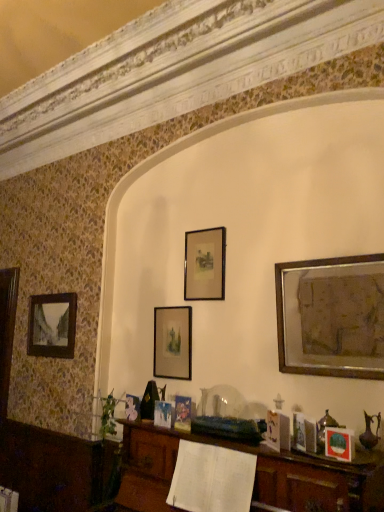
Describe the element at coordinates (339, 444) in the screenshot. This screenshot has height=512, width=384. I see `matte black picture frame at lower right, the second picture frame in the right-to-left sequence` at that location.

This screenshot has height=512, width=384. Find the location of `matte black picture frame at center, marked as the 4th picture frame in a right-to-left arrangement`. matte black picture frame at center, marked as the 4th picture frame in a right-to-left arrangement is located at coordinates (173, 342).

Measure the distance between matte black picture frame at left, arranged as the 5th picture frame when viewed from the right, and camera.

3.34 meters.

The height and width of the screenshot is (512, 384). Find the location of `matte black picture frame at lower right, the fourth picture frame in the left-to-right sequence`. matte black picture frame at lower right, the fourth picture frame in the left-to-right sequence is located at coordinates (339, 444).

The height and width of the screenshot is (512, 384). I want to click on the 2nd picture frame to the right of the matte black picture frame at left, acting as the 1th picture frame starting from the left, starting your count from the anchor, so click(x=205, y=264).

From a real-world perspective, is matte black picture frame at left, arranged as the 5th picture frame when viewed from the right, positioned above or below matte black picture frame at center, which ranks as the third picture frame in left-to-right order?

matte black picture frame at left, arranged as the 5th picture frame when viewed from the right, is situated lower than matte black picture frame at center, which ranks as the third picture frame in left-to-right order, in the real world.

Is matte black picture frame at left, acting as the first picture frame starting from the back, wider or thinner than matte black picture frame at center, which ranks as the third picture frame in left-to-right order?

Clearly, matte black picture frame at left, acting as the first picture frame starting from the back, has more width compared to matte black picture frame at center, which ranks as the third picture frame in left-to-right order.

Is matte black picture frame at left, arranged as the 5th picture frame when viewed from the right, shorter than matte black picture frame at center, which ranks as the third picture frame in front-to-back order?

No.

Can matte black picture frame at left, arranged as the 5th picture frame when viewed from the right, be found inside matte black picture frame at lower right, marked as the fifth picture frame in a back-to-front arrangement?

No, matte black picture frame at left, arranged as the 5th picture frame when viewed from the right, is not surrounded by matte black picture frame at lower right, marked as the fifth picture frame in a back-to-front arrangement.

Is matte black picture frame at lower right, which appears as the first picture frame when viewed from the front, closer to camera compared to matte black picture frame at left, acting as the first picture frame starting from the back?

Yes, matte black picture frame at lower right, which appears as the first picture frame when viewed from the front, is closer to the viewer.

Between matte black picture frame at lower right, the second picture frame in the right-to-left sequence, and matte black picture frame at left, acting as the first picture frame starting from the back, which one has larger size?

Bigger between the two is matte black picture frame at left, acting as the first picture frame starting from the back.

In the scene shown: Considering the positions of objects matte black picture frame at lower right, the second picture frame in the right-to-left sequence, and matte black picture frame at left, acting as the 1th picture frame starting from the left, in the image provided, who is more to the left, matte black picture frame at lower right, the second picture frame in the right-to-left sequence, or matte black picture frame at left, acting as the 1th picture frame starting from the left,?

matte black picture frame at left, acting as the 1th picture frame starting from the left, is more to the left.

Does matte black picture frame at left, marked as the fifth picture frame in a front-to-back arrangement, lie in front of matte black picture frame at lower right, the second picture frame in the right-to-left sequence?

No, the depth of matte black picture frame at left, marked as the fifth picture frame in a front-to-back arrangement, is greater than that of matte black picture frame at lower right, the second picture frame in the right-to-left sequence.

Is matte black picture frame at left, acting as the first picture frame starting from the back, taller than matte black picture frame at lower right, the fourth picture frame in the left-to-right sequence?

Yes.

Do you think matte black picture frame at left, acting as the first picture frame starting from the back, is within matte black picture frame at lower right, marked as the fifth picture frame in a back-to-front arrangement, or outside of it?

matte black picture frame at left, acting as the first picture frame starting from the back, lies outside matte black picture frame at lower right, marked as the fifth picture frame in a back-to-front arrangement.

Is matte black picture frame at left, arranged as the 5th picture frame when viewed from the right, looking in the opposite direction of matte black picture frame at lower right, marked as the fifth picture frame in a back-to-front arrangement?

No.

Which of these two, gold metallic picture frame at upper right, which ranks as the fifth picture frame in left-to-right order, or matte black picture frame at center, the third picture frame in the back-to-front sequence, is wider?

gold metallic picture frame at upper right, which ranks as the fifth picture frame in left-to-right order.

How far apart are gold metallic picture frame at upper right, the second picture frame in the front-to-back sequence, and matte black picture frame at center, the 3th picture frame from the right?

gold metallic picture frame at upper right, the second picture frame in the front-to-back sequence, is 25.97 inches from matte black picture frame at center, the 3th picture frame from the right.

From a real-world perspective, relative to matte black picture frame at center, which ranks as the third picture frame in left-to-right order, is gold metallic picture frame at upper right, the second picture frame in the front-to-back sequence, vertically above or below?

From a real-world perspective, gold metallic picture frame at upper right, the second picture frame in the front-to-back sequence, is physically below matte black picture frame at center, which ranks as the third picture frame in left-to-right order.

Considering the sizes of matte black picture frame at lower right, the second picture frame in the right-to-left sequence, and matte black picture frame at center, which ranks as the third picture frame in front-to-back order, in the image, is matte black picture frame at lower right, the second picture frame in the right-to-left sequence, taller or shorter than matte black picture frame at center, which ranks as the third picture frame in front-to-back order,?

Clearly, matte black picture frame at lower right, the second picture frame in the right-to-left sequence, is shorter compared to matte black picture frame at center, which ranks as the third picture frame in front-to-back order.

How many degrees apart are the facing directions of matte black picture frame at lower right, which appears as the first picture frame when viewed from the front, and matte black picture frame at center, which ranks as the third picture frame in left-to-right order?

12.4 degrees separate the facing orientations of matte black picture frame at lower right, which appears as the first picture frame when viewed from the front, and matte black picture frame at center, which ranks as the third picture frame in left-to-right order.

Is matte black picture frame at lower right, which appears as the first picture frame when viewed from the front, next to matte black picture frame at center, the third picture frame in the back-to-front sequence?

matte black picture frame at lower right, which appears as the first picture frame when viewed from the front, and matte black picture frame at center, the third picture frame in the back-to-front sequence, are not in contact.

Which object is thinner, matte black picture frame at lower right, the fourth picture frame in the left-to-right sequence, or matte black picture frame at center, the 3th picture frame from the right?

With smaller width is matte black picture frame at center, the 3th picture frame from the right.

Would you say matte black picture frame at lower right, the fourth picture frame in the left-to-right sequence, is to the left or to the right of matte black picture frame at center, which is counted as the fourth picture frame, starting from the front, in the picture?

matte black picture frame at lower right, the fourth picture frame in the left-to-right sequence, is to the right of matte black picture frame at center, which is counted as the fourth picture frame, starting from the front.

From their relative heights in the image, would you say matte black picture frame at lower right, marked as the fifth picture frame in a back-to-front arrangement, is taller or shorter than matte black picture frame at center, marked as the 4th picture frame in a right-to-left arrangement?

matte black picture frame at lower right, marked as the fifth picture frame in a back-to-front arrangement, is shorter than matte black picture frame at center, marked as the 4th picture frame in a right-to-left arrangement.

From a real-world perspective, between matte black picture frame at lower right, marked as the fifth picture frame in a back-to-front arrangement, and matte black picture frame at center, which is counted as the fourth picture frame, starting from the front, who is vertically lower?

In real-world perspective, matte black picture frame at lower right, marked as the fifth picture frame in a back-to-front arrangement, is lower.

Consider the image. Is gold metallic picture frame at upper right, which ranks as the fifth picture frame in left-to-right order, taller than matte black picture frame at center, acting as the second picture frame starting from the left?

Indeed, gold metallic picture frame at upper right, which ranks as the fifth picture frame in left-to-right order, has a greater height compared to matte black picture frame at center, acting as the second picture frame starting from the left.

From the image's perspective, which object appears higher, gold metallic picture frame at upper right, which is counted as the fourth picture frame, starting from the back, or matte black picture frame at center, which is counted as the fourth picture frame, starting from the front?

gold metallic picture frame at upper right, which is counted as the fourth picture frame, starting from the back, appears higher in the image.

Is gold metallic picture frame at upper right, the second picture frame in the front-to-back sequence, oriented towards matte black picture frame at center, marked as the 4th picture frame in a right-to-left arrangement?

No, gold metallic picture frame at upper right, the second picture frame in the front-to-back sequence, is not facing towards matte black picture frame at center, marked as the 4th picture frame in a right-to-left arrangement.

Considering the sizes of gold metallic picture frame at upper right, positioned as the 1th picture frame in right-to-left order, and matte black picture frame at center, marked as the 4th picture frame in a right-to-left arrangement, in the image, is gold metallic picture frame at upper right, positioned as the 1th picture frame in right-to-left order, wider or thinner than matte black picture frame at center, marked as the 4th picture frame in a right-to-left arrangement,?

Clearly, gold metallic picture frame at upper right, positioned as the 1th picture frame in right-to-left order, has more width compared to matte black picture frame at center, marked as the 4th picture frame in a right-to-left arrangement.

The image size is (384, 512). In order to click on picture frame that is the 2nd one below the matte black picture frame at center, which ranks as the third picture frame in left-to-right order (from a real-world perspective) in this screenshot , I will do `click(52, 325)`.

Where is `the 2nd picture frame positioned above the matte black picture frame at lower right, the second picture frame in the right-to-left sequence (from a real-world perspective)`? This screenshot has height=512, width=384. the 2nd picture frame positioned above the matte black picture frame at lower right, the second picture frame in the right-to-left sequence (from a real-world perspective) is located at coordinates (52, 325).

Looking at the image, which one is located closer to gold metallic picture frame at upper right, which is counted as the fourth picture frame, starting from the back, matte black picture frame at lower right, the second picture frame in the right-to-left sequence, or matte black picture frame at center, the third picture frame in the back-to-front sequence?

The object closer to gold metallic picture frame at upper right, which is counted as the fourth picture frame, starting from the back, is matte black picture frame at lower right, the second picture frame in the right-to-left sequence.

Looking at the image, which one is located further to matte black picture frame at lower right, the fourth picture frame in the left-to-right sequence, matte black picture frame at center, the 3th picture frame from the right, or gold metallic picture frame at upper right, the second picture frame in the front-to-back sequence?

matte black picture frame at center, the 3th picture frame from the right, lies further to matte black picture frame at lower right, the fourth picture frame in the left-to-right sequence, than the other object.

From the image, which object appears to be farther from matte black picture frame at center, which ranks as the third picture frame in front-to-back order, gold metallic picture frame at upper right, positioned as the 1th picture frame in right-to-left order, or matte black picture frame at center, marked as the 4th picture frame in a right-to-left arrangement?

gold metallic picture frame at upper right, positioned as the 1th picture frame in right-to-left order, lies further to matte black picture frame at center, which ranks as the third picture frame in front-to-back order, than the other object.

Considering their positions, is matte black picture frame at lower right, the fourth picture frame in the left-to-right sequence, positioned closer to matte black picture frame at center, the 3th picture frame from the right, than matte black picture frame at left, marked as the fifth picture frame in a front-to-back arrangement?

The object closer to matte black picture frame at center, the 3th picture frame from the right, is matte black picture frame at lower right, the fourth picture frame in the left-to-right sequence.

From the image, which object appears to be nearer to gold metallic picture frame at upper right, which ranks as the fifth picture frame in left-to-right order, matte black picture frame at center, acting as the second picture frame starting from the left, or matte black picture frame at center, which ranks as the third picture frame in front-to-back order?

matte black picture frame at center, which ranks as the third picture frame in front-to-back order, lies closer to gold metallic picture frame at upper right, which ranks as the fifth picture frame in left-to-right order, than the other object.

Which object lies further to the anchor point gold metallic picture frame at upper right, which is counted as the fourth picture frame, starting from the back, matte black picture frame at lower right, which appears as the first picture frame when viewed from the front, or matte black picture frame at center, marked as the 4th picture frame in a right-to-left arrangement?

The object further to gold metallic picture frame at upper right, which is counted as the fourth picture frame, starting from the back, is matte black picture frame at center, marked as the 4th picture frame in a right-to-left arrangement.

Based on their spatial positions, is gold metallic picture frame at upper right, which ranks as the fifth picture frame in left-to-right order, or matte black picture frame at center, acting as the second picture frame starting from the left, closer to matte black picture frame at lower right, which appears as the first picture frame when viewed from the front?

Based on the image, gold metallic picture frame at upper right, which ranks as the fifth picture frame in left-to-right order, appears to be nearer to matte black picture frame at lower right, which appears as the first picture frame when viewed from the front.

Based on their spatial positions, is matte black picture frame at lower right, which appears as the first picture frame when viewed from the front, or gold metallic picture frame at upper right, which is counted as the fourth picture frame, starting from the back, closer to matte black picture frame at center, the 3th picture frame from the right?

gold metallic picture frame at upper right, which is counted as the fourth picture frame, starting from the back, is positioned closer to the anchor matte black picture frame at center, the 3th picture frame from the right.

Where is `picture frame positioned between matte black picture frame at lower right, the second picture frame in the right-to-left sequence, and matte black picture frame at center, the third picture frame in the back-to-front sequence, from near to far`? picture frame positioned between matte black picture frame at lower right, the second picture frame in the right-to-left sequence, and matte black picture frame at center, the third picture frame in the back-to-front sequence, from near to far is located at coordinates (331, 317).

Image resolution: width=384 pixels, height=512 pixels. What are the coordinates of `picture frame situated between matte black picture frame at left, arranged as the 5th picture frame when viewed from the right, and matte black picture frame at center, which ranks as the third picture frame in front-to-back order, from left to right` in the screenshot? It's located at (173, 342).